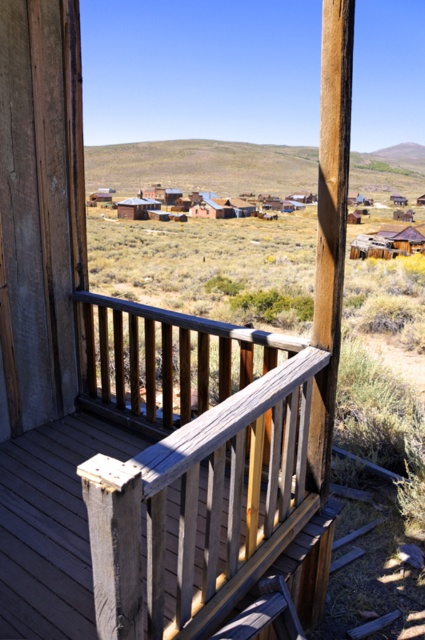
You are standing on the wooden porch and want to know which of the two points, point (107, 476) or point (351, 253), is nearer to you. Which one would it be?

A: Point (107, 476) is closer to the camera than point (351, 253), so it is nearer to you.

You are standing on the wooden porch and want to determine the relative positions of two points in the scene. Which point, point (404,243) or point (130,196), is closer to you?

Point (404,243) is closer to the camera than point (130,196).